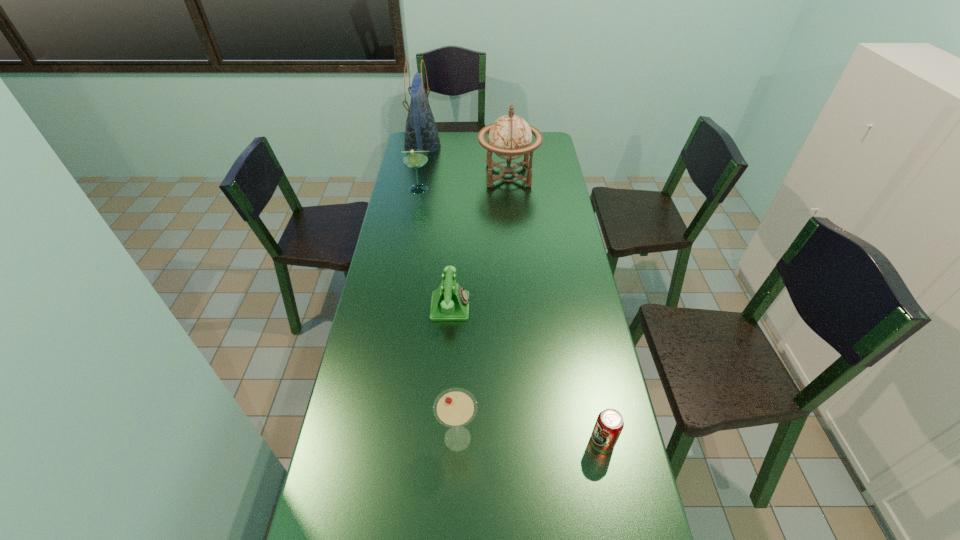
Locate an element on the screen. This screenshot has width=960, height=540. vacant space located 0.310m on the right of the left martini is located at coordinates (502, 189).

Where is `vacant region located 0.130m on the back of the nearer martini`? vacant region located 0.130m on the back of the nearer martini is located at coordinates coord(460,378).

Find the location of a particular element. This screenshot has width=960, height=540. vacant space located on the dial of the telephone is located at coordinates (538, 306).

Where is `free space located on the back of the soda`? free space located on the back of the soda is located at coordinates (592, 390).

I want to click on object that is at the far edge, so click(421, 132).

At what (x,y) coordinates should I click in order to perform the action: click on shopping bag located in the left edge section of the desktop. Please return your answer as a coordinate pair (x, y). This screenshot has width=960, height=540. Looking at the image, I should click on (421, 132).

Identify the location of martini that is at the left edge. The width and height of the screenshot is (960, 540). (415, 158).

At what (x,y) coordinates should I click in order to perform the action: click on globe positioned at the right edge. Please return your answer as a coordinate pair (x, y). The image size is (960, 540). Looking at the image, I should click on (509, 137).

Identify the location of soda situated at the right edge. (609, 424).

Find the location of a particular element. The height and width of the screenshot is (540, 960). object located in the far left corner section of the desktop is located at coordinates (421, 132).